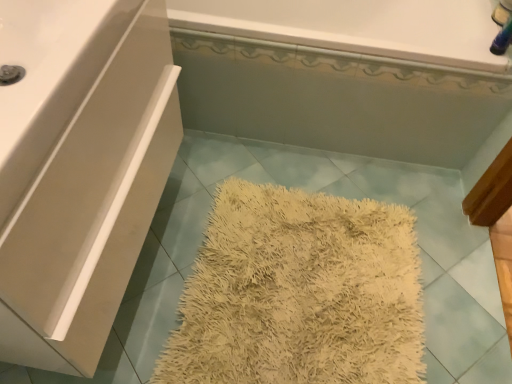
Find the location of a particular element. The height and width of the screenshot is (384, 512). white glossy counter top at upper left is located at coordinates (x=49, y=79).

What do you see at coordinates (358, 27) in the screenshot? I see `white glossy bathtub at upper center, the 2th bath positioned from the front` at bounding box center [358, 27].

The height and width of the screenshot is (384, 512). Describe the element at coordinates (79, 169) in the screenshot. I see `white matte cabinet at upper left` at that location.

Locate an element on the screen. The width and height of the screenshot is (512, 384). white matte cabinet at upper left is located at coordinates (79, 169).

Identify the location of white glossy counter top at upper left. (49, 79).

Does white glossy bathtub at upper center, marked as the 1th bath in a back-to-front arrangement, come in front of white glossy bathtub at upper center, which is counted as the second bath, starting from the back?

No, it is not.

From the image's perspective, who appears lower, white glossy bathtub at upper center, the 2th bath positioned from the front, or white glossy bathtub at upper center, the 1th bath in the front-to-back sequence?

white glossy bathtub at upper center, the 2th bath positioned from the front, appears lower in the image.

Could you measure the distance between white glossy bathtub at upper center, the 2th bath positioned from the front, and white glossy bathtub at upper center, which is counted as the second bath, starting from the back?

They are 4.74 inches apart.

Is white glossy bathtub at upper center, marked as the 1th bath in a back-to-front arrangement, far away from white glossy bathtub at upper center, which is counted as the second bath, starting from the back?

No, there isn't a large distance between white glossy bathtub at upper center, marked as the 1th bath in a back-to-front arrangement, and white glossy bathtub at upper center, which is counted as the second bath, starting from the back.

Is white matte cabinet at upper left a part of white glossy counter top at upper left?

Definitely not — white matte cabinet at upper left is not inside white glossy counter top at upper left.

Considering the relative sizes of white glossy counter top at upper left and white matte cabinet at upper left in the image provided, is white glossy counter top at upper left thinner than white matte cabinet at upper left?

Indeed, white glossy counter top at upper left has a lesser width compared to white matte cabinet at upper left.

Considering the sizes of objects white glossy counter top at upper left and white matte cabinet at upper left in the image provided, who is shorter, white glossy counter top at upper left or white matte cabinet at upper left?

Standing shorter between the two is white glossy counter top at upper left.

Considering the relative positions of white glossy bathtub at upper center, the 2th bath positioned from the front, and white matte cabinet at upper left in the image provided, is white glossy bathtub at upper center, the 2th bath positioned from the front, to the left or to the right of white matte cabinet at upper left?

In the image, white glossy bathtub at upper center, the 2th bath positioned from the front, appears on the right side of white matte cabinet at upper left.

How different are the orientations of white glossy bathtub at upper center, the 2th bath positioned from the front, and white matte cabinet at upper left in degrees?

91 degrees separate the facing orientations of white glossy bathtub at upper center, the 2th bath positioned from the front, and white matte cabinet at upper left.

From the picture: From the image's perspective, is white glossy bathtub at upper center, marked as the 1th bath in a back-to-front arrangement, above or below white matte cabinet at upper left?

white glossy bathtub at upper center, marked as the 1th bath in a back-to-front arrangement, is situated higher than white matte cabinet at upper left in the image.

Does point (511, 69) lie in front of point (96, 71)?

That is False.

Who is smaller, white matte cabinet at upper left or white glossy bathtub at upper center, the 2th bath positioned from the front?

With smaller size is white glossy bathtub at upper center, the 2th bath positioned from the front.

In the image, there is a white glossy bathtub at upper center, marked as the 1th bath in a back-to-front arrangement. Where is `bathroom cabinet below it (from the image's perspective)`? This screenshot has width=512, height=384. bathroom cabinet below it (from the image's perspective) is located at coordinates (79, 169).

From the image's perspective, which is above, white matte cabinet at upper left or white glossy bathtub at upper center, the 2th bath positioned from the front?

white glossy bathtub at upper center, the 2th bath positioned from the front.

Does point (72, 330) appear closer or farther from the camera than point (459, 11)?

Point (72, 330).

Does white glossy bathtub at upper center, marked as the 1th bath in a back-to-front arrangement, have a smaller size compared to white glossy counter top at upper left?

Correct, white glossy bathtub at upper center, marked as the 1th bath in a back-to-front arrangement, occupies less space than white glossy counter top at upper left.

Does white glossy bathtub at upper center, the 2th bath positioned from the front, have a lesser width compared to white glossy counter top at upper left?

Indeed, white glossy bathtub at upper center, the 2th bath positioned from the front, has a lesser width compared to white glossy counter top at upper left.

Which is closer, (402,19) or (44,7)?

The point (44,7) is closer to the camera.

Can you confirm if white glossy bathtub at upper center, marked as the 1th bath in a back-to-front arrangement, is taller than white glossy counter top at upper left?

No, white glossy bathtub at upper center, marked as the 1th bath in a back-to-front arrangement, is not taller than white glossy counter top at upper left.

Is white glossy counter top at upper left a part of white matte cabinet at upper left?

Yes.

How distant is white matte cabinet at upper left from white glossy counter top at upper left?

white matte cabinet at upper left is 6.72 inches away from white glossy counter top at upper left.

Considering the sizes of objects white matte cabinet at upper left and white glossy counter top at upper left in the image provided, who is shorter, white matte cabinet at upper left or white glossy counter top at upper left?

With less height is white glossy counter top at upper left.

Looking at the image, does white glossy counter top at upper left seem bigger or smaller compared to white glossy bathtub at upper center, the 1th bath in the front-to-back sequence?

Clearly, white glossy counter top at upper left is smaller in size than white glossy bathtub at upper center, the 1th bath in the front-to-back sequence.

From the image's perspective, which one is positioned higher, white glossy counter top at upper left or white glossy bathtub at upper center, the 1th bath in the front-to-back sequence?

white glossy bathtub at upper center, the 1th bath in the front-to-back sequence.

Which object is positioned more to the right, white glossy counter top at upper left or white glossy bathtub at upper center, which is counted as the second bath, starting from the back?

Positioned to the right is white glossy bathtub at upper center, which is counted as the second bath, starting from the back.

I want to click on bath above the white glossy bathtub at upper center, marked as the 1th bath in a back-to-front arrangement (from the image's perspective), so click(340, 75).

Where is `counter top that is above the white matte cabinet at upper left (from a real-world perspective)`? The image size is (512, 384). counter top that is above the white matte cabinet at upper left (from a real-world perspective) is located at coordinates (49, 79).

Consider the image. Estimate the real-world distances between objects in this image. Which object is further from white matte cabinet at upper left, white glossy bathtub at upper center, the 1th bath in the front-to-back sequence, or white glossy bathtub at upper center, the 2th bath positioned from the front?

The object further to white matte cabinet at upper left is white glossy bathtub at upper center, the 2th bath positioned from the front.

Which object lies nearer to the anchor point white matte cabinet at upper left, white glossy bathtub at upper center, the 1th bath in the front-to-back sequence, or white glossy counter top at upper left?

white glossy counter top at upper left is closer to white matte cabinet at upper left.

From the image, which object appears to be nearer to white glossy bathtub at upper center, marked as the 1th bath in a back-to-front arrangement, white matte cabinet at upper left or white glossy bathtub at upper center, the 1th bath in the front-to-back sequence?

The object closer to white glossy bathtub at upper center, marked as the 1th bath in a back-to-front arrangement, is white glossy bathtub at upper center, the 1th bath in the front-to-back sequence.

Looking at the image, which one is located further to white glossy bathtub at upper center, which is counted as the second bath, starting from the back, white glossy counter top at upper left or white glossy bathtub at upper center, marked as the 1th bath in a back-to-front arrangement?

white glossy counter top at upper left.

Based on their spatial positions, is white glossy bathtub at upper center, which is counted as the second bath, starting from the back, or white matte cabinet at upper left further from white glossy bathtub at upper center, the 2th bath positioned from the front?

white matte cabinet at upper left lies further to white glossy bathtub at upper center, the 2th bath positioned from the front, than the other object.

Estimate the real-world distances between objects in this image. Which object is further from white glossy bathtub at upper center, which is counted as the second bath, starting from the back, white glossy bathtub at upper center, the 2th bath positioned from the front, or white glossy counter top at upper left?

white glossy counter top at upper left lies further to white glossy bathtub at upper center, which is counted as the second bath, starting from the back, than the other object.

Based on their spatial positions, is white glossy counter top at upper left or white glossy bathtub at upper center, the 1th bath in the front-to-back sequence, further from white glossy bathtub at upper center, marked as the 1th bath in a back-to-front arrangement?

Among the two, white glossy counter top at upper left is located further to white glossy bathtub at upper center, marked as the 1th bath in a back-to-front arrangement.

Which object lies further to the anchor point white glossy counter top at upper left, white glossy bathtub at upper center, the 1th bath in the front-to-back sequence, or white glossy bathtub at upper center, the 2th bath positioned from the front?

white glossy bathtub at upper center, the 1th bath in the front-to-back sequence, is further to white glossy counter top at upper left.

Where is `bath between white matte cabinet at upper left and white glossy bathtub at upper center, marked as the 1th bath in a back-to-front arrangement, from front to back`? The image size is (512, 384). bath between white matte cabinet at upper left and white glossy bathtub at upper center, marked as the 1th bath in a back-to-front arrangement, from front to back is located at coordinates (340, 75).

Image resolution: width=512 pixels, height=384 pixels. I want to click on bath positioned between white glossy counter top at upper left and white glossy bathtub at upper center, the 2th bath positioned from the front, from near to far, so click(340, 75).

You are a GUI agent. You are given a task and a screenshot of the screen. Output one action in this format:
    pyautogui.click(x=<x>, y=<y>)
    Task: Click on the bathroom cabinet between white glossy counter top at upper left and white glossy bathtub at upper center, the 2th bath positioned from the front, along the z-axis
    
    Given the screenshot: What is the action you would take?
    pyautogui.click(x=79, y=169)

Locate an element on the screen. bathroom cabinet between white glossy counter top at upper left and white glossy bathtub at upper center, the 1th bath in the front-to-back sequence, from front to back is located at coordinates (79, 169).